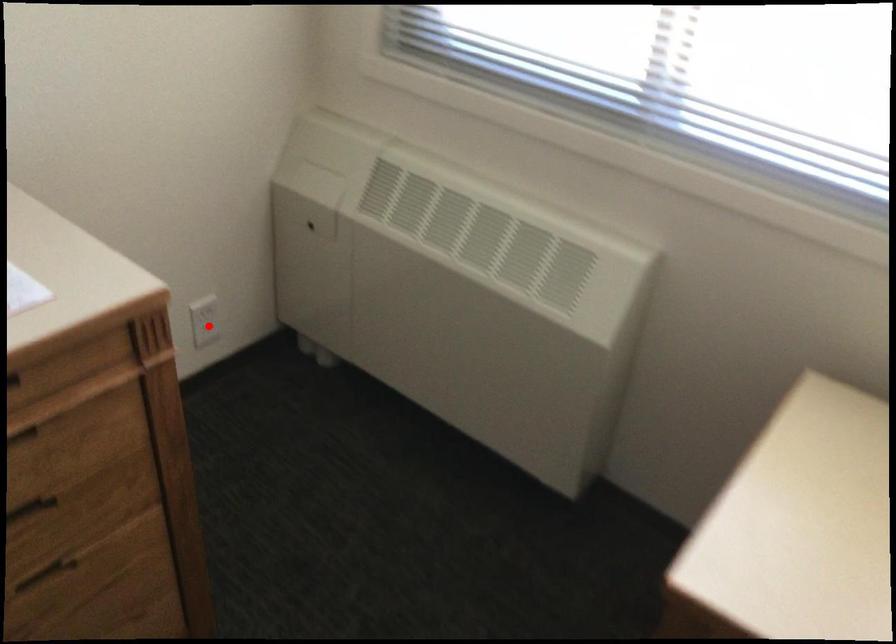
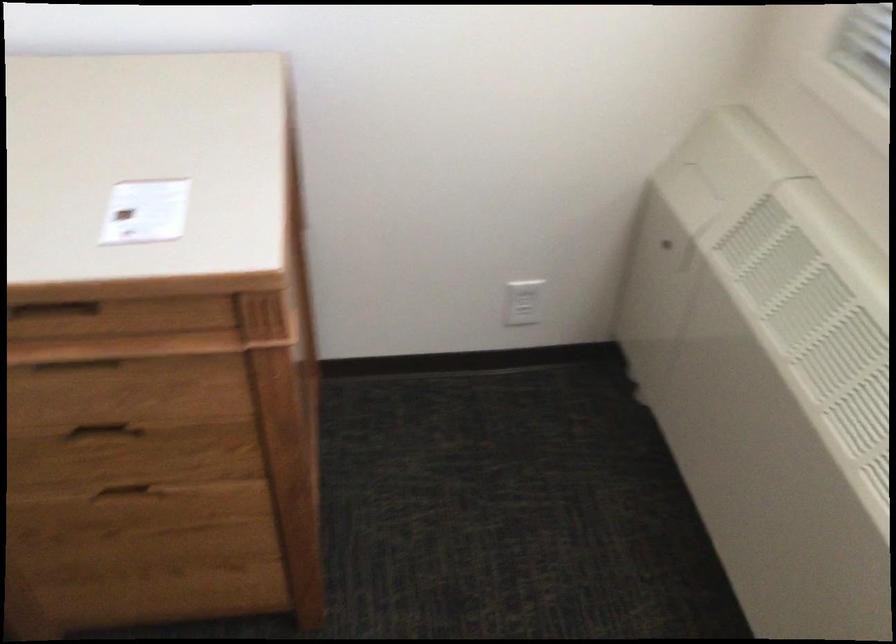
The point at the highlighted location is marked in the first image. Where is the corresponding point in the second image?

(522, 301)